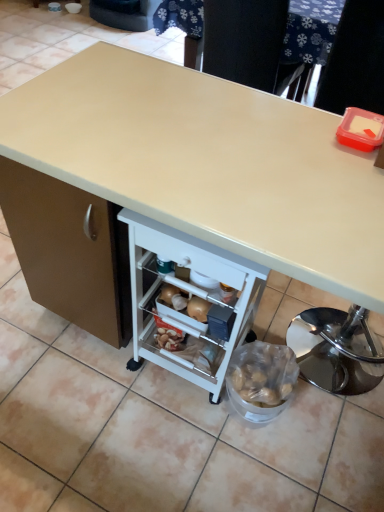
Question: Does beige laminate desk at center turn towards beige laminate table at upper center?

Choices:
 (A) no
 (B) yes

Answer: (A)

Question: From the image's perspective, is beige laminate desk at center located beneath beige laminate table at upper center?

Choices:
 (A) yes
 (B) no

Answer: (A)

Question: Does beige laminate desk at center appear on the left side of beige laminate table at upper center?

Choices:
 (A) yes
 (B) no

Answer: (A)

Question: Considering the relative sizes of beige laminate desk at center and beige laminate table at upper center in the image provided, is beige laminate desk at center shorter than beige laminate table at upper center?

Choices:
 (A) no
 (B) yes

Answer: (A)

Question: Is beige laminate desk at center completely or partially outside of beige laminate table at upper center?

Choices:
 (A) yes
 (B) no

Answer: (A)

Question: From the image's perspective, would you say beige laminate desk at center is positioned over beige laminate table at upper center?

Choices:
 (A) no
 (B) yes

Answer: (A)

Question: Are beige laminate table at upper center and beige laminate desk at center beside each other?

Choices:
 (A) yes
 (B) no

Answer: (B)

Question: Is beige laminate table at upper center to the left of beige laminate desk at center from the viewer's perspective?

Choices:
 (A) no
 (B) yes

Answer: (A)

Question: Can you confirm if beige laminate table at upper center is positioned to the right of beige laminate desk at center?

Choices:
 (A) no
 (B) yes

Answer: (B)

Question: Is beige laminate desk at center located within beige laminate table at upper center?

Choices:
 (A) no
 (B) yes

Answer: (A)

Question: From the image's perspective, is beige laminate table at upper center located beneath beige laminate desk at center?

Choices:
 (A) no
 (B) yes

Answer: (A)

Question: Is beige laminate table at upper center behind beige laminate desk at center?

Choices:
 (A) yes
 (B) no

Answer: (A)

Question: From the image's perspective, relative to beige laminate table at upper center, is beige laminate desk at center above or below?

Choices:
 (A) above
 (B) below

Answer: (B)